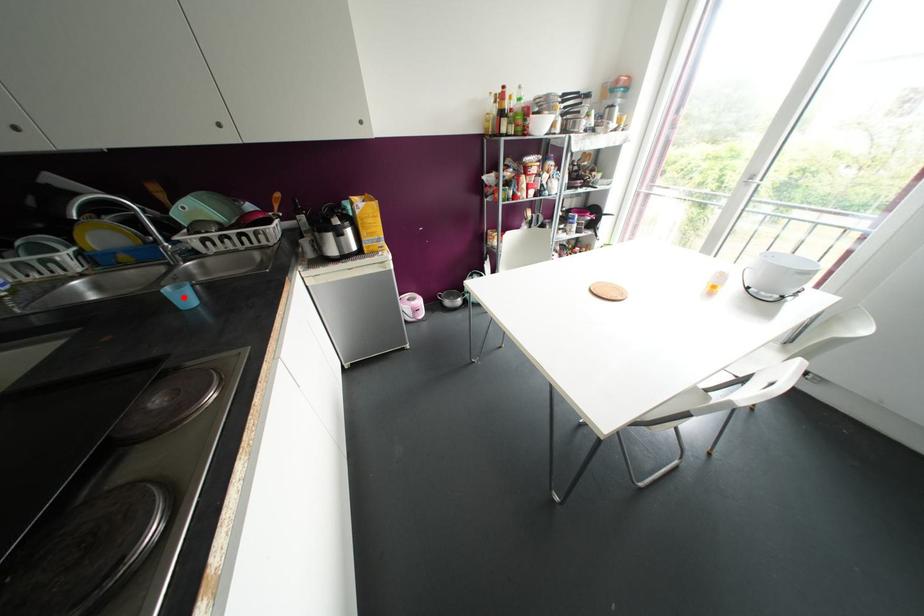
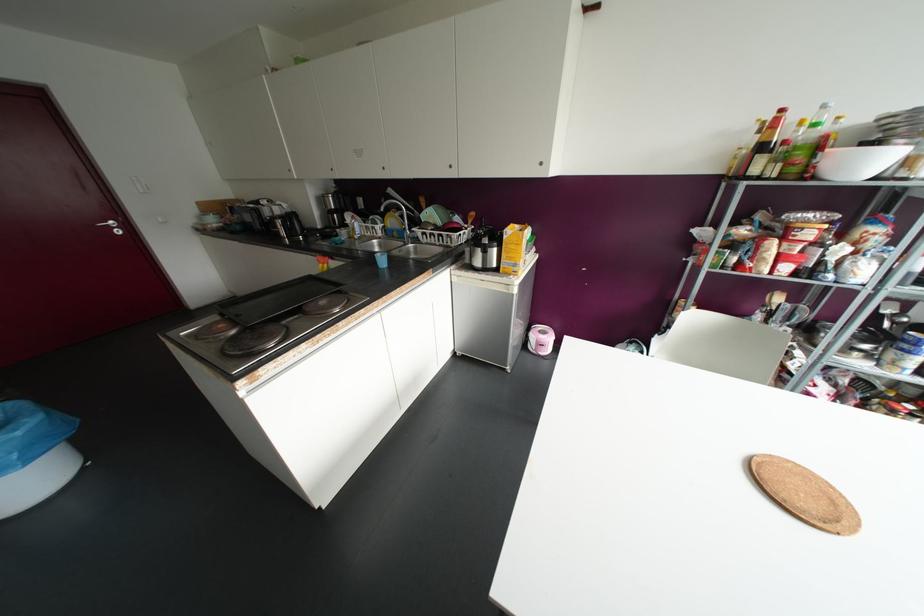
Find the pixel in the second image that matches the highlighted location in the first image.

(382, 261)